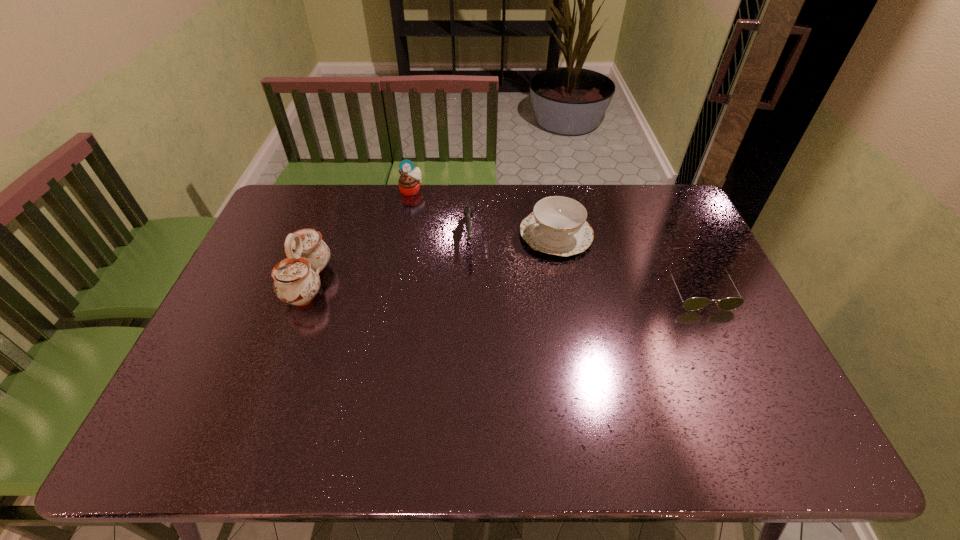
You are a GUI agent. You are given a task and a screenshot of the screen. Output one action in this format:
    pyautogui.click(x=<x>, y=<y>)
    Task: Click on the vacant area situated 0.240m on the front-facing side of the rightmost object
    The width and height of the screenshot is (960, 540).
    Given the screenshot: What is the action you would take?
    (x=745, y=388)

Where is `vacant area situated aiming along the barrel of the gun`? vacant area situated aiming along the barrel of the gun is located at coordinates point(475,368).

Image resolution: width=960 pixels, height=540 pixels. I want to click on vacant space located 0.360m aiming along the barrel of the gun, so click(x=474, y=355).

Identify the location of vacant space located aiming along the barrel of the gun. This screenshot has width=960, height=540. (473, 345).

At what (x,y) coordinates should I click in order to perform the action: click on free location located on the handle side of the right chinaware. Please return your answer as a coordinate pair (x, y). Image resolution: width=960 pixels, height=540 pixels. Looking at the image, I should click on 448,289.

Locate an element on the screen. This screenshot has width=960, height=540. blank area located on the handle side of the right chinaware is located at coordinates (490, 268).

Where is `vacant space located on the handle side of the right chinaware`? Image resolution: width=960 pixels, height=540 pixels. vacant space located on the handle side of the right chinaware is located at coordinates (471, 278).

Image resolution: width=960 pixels, height=540 pixels. Find the location of `vacant space located 0.390m on the front-facing side of the fourth object from right to left`. vacant space located 0.390m on the front-facing side of the fourth object from right to left is located at coordinates (459, 264).

Image resolution: width=960 pixels, height=540 pixels. I want to click on vacant space situated 0.230m on the front-facing side of the fourth object from right to left, so click(439, 234).

This screenshot has width=960, height=540. What are the coordinates of `free space located on the front-facing side of the fourth object from right to left` in the screenshot? It's located at (430, 220).